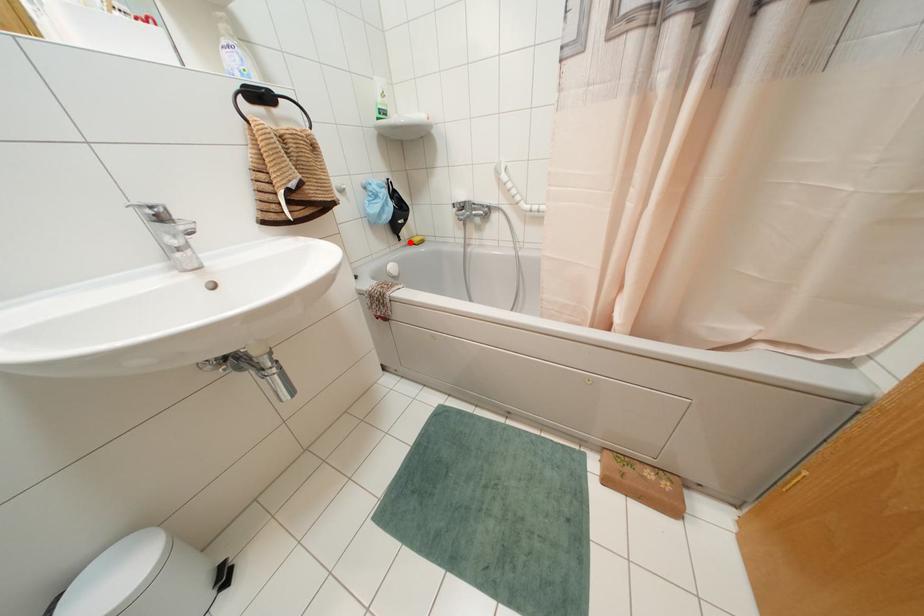
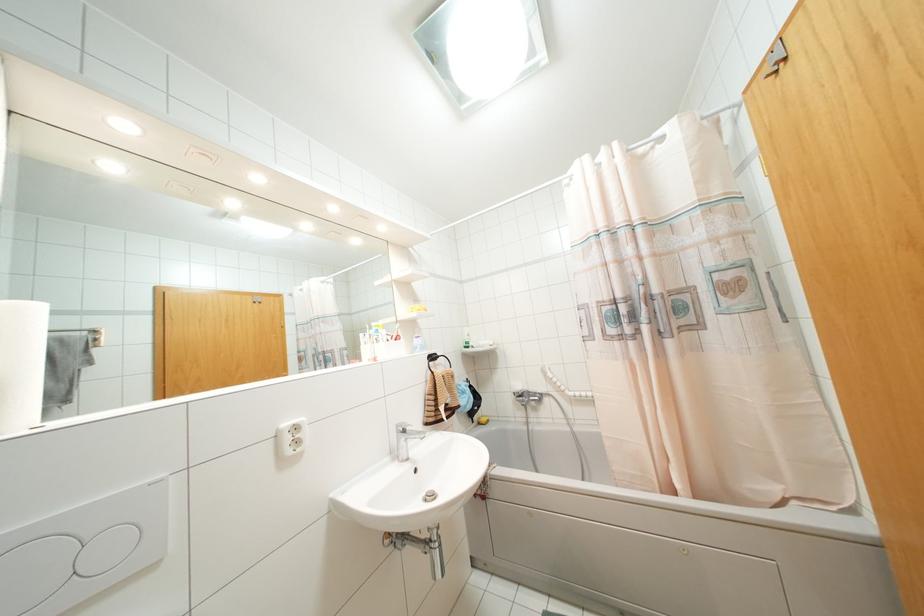
Question: I am providing you with two images of the same scene from different viewpoints. Image1 has a red point marked. In image2, the corresponding 3D location appears at what relative position? Reply with the corresponding letter.

Choices:
 (A) Closer
 (B) Farther

Answer: (B)